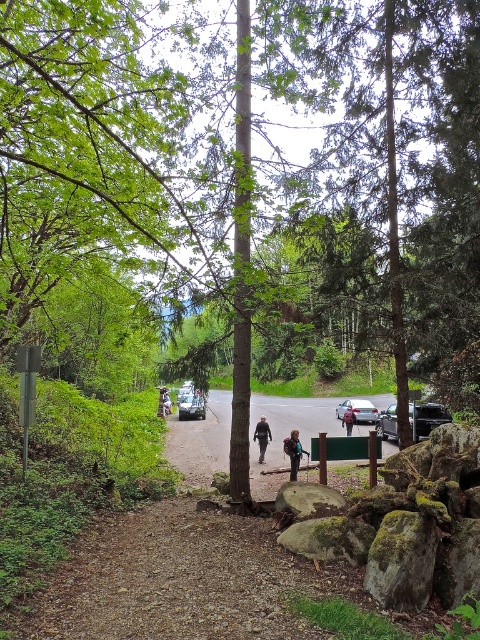
Question: Is gravel path at center positioned behind shiny silver car at center?

Choices:
 (A) yes
 (B) no

Answer: (B)

Question: Which object is the closest to the light brown leather jacket at center?

Choices:
 (A) shiny silver car at center
 (B) metallic silver car at center

Answer: (A)

Question: Which is nearer to the metallic silver car at center?

Choices:
 (A) shiny silver car at center
 (B) dark brown backpack at center
 (C) dark gray jacket at center

Answer: (B)

Question: Observing the image, what is the correct spatial positioning of dark brown backpack at center in reference to brown leather jacket at center?

Choices:
 (A) below
 (B) above

Answer: (A)

Question: Is metallic silver car at center smaller than brown leather jacket at center?

Choices:
 (A) yes
 (B) no

Answer: (A)

Question: Which point is closer to the camera taking this photo?

Choices:
 (A) (194, 410)
 (B) (164, 417)
 (C) (168, 394)

Answer: (A)